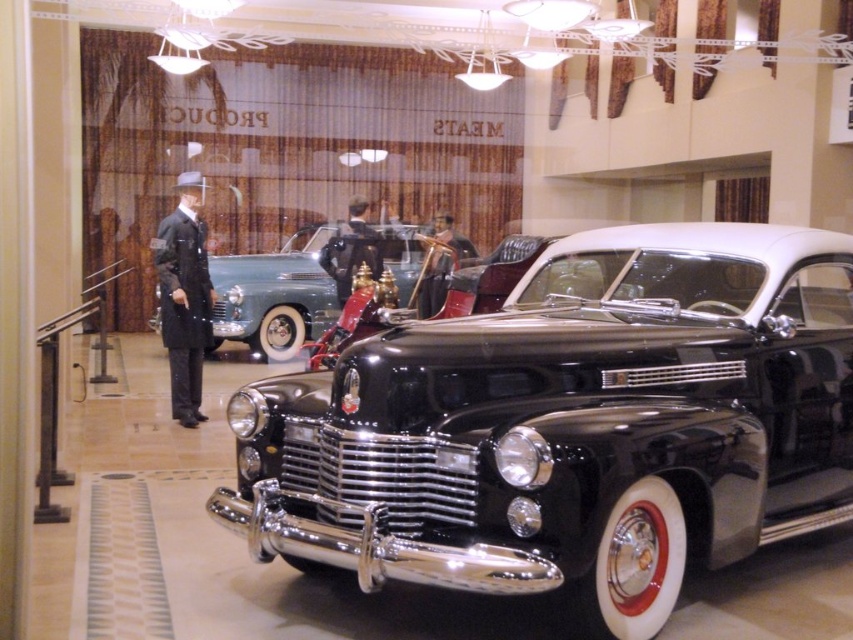
Between shiny black car at center and matte black suit at left, which one appears on the right side from the viewer's perspective?

shiny black car at center

Describe the element at coordinates (276, 296) in the screenshot. I see `shiny black car at center` at that location.

Identify the location of shiny black car at center. The height and width of the screenshot is (640, 853). (276, 296).

Which is more to the left, shiny chrome pickup at center or smooth leather jacket at center?

Positioned to the left is smooth leather jacket at center.

In the scene shown: Is shiny chrome pickup at center further to camera compared to smooth leather jacket at center?

No, it is in front of smooth leather jacket at center.

Between point (581, 456) and point (364, 259), which one is positioned in front?

Point (581, 456) is more forward.

Find the location of `shiny chrome pickup at center`. shiny chrome pickup at center is located at coordinates (572, 426).

In order to click on shiny chrome pickup at center in this screenshot , I will do `click(572, 426)`.

Does shiny chrome pickup at center have a lesser width compared to shiny black car at center?

In fact, shiny chrome pickup at center might be wider than shiny black car at center.

Identify the location of shiny chrome pickup at center. The image size is (853, 640). (572, 426).